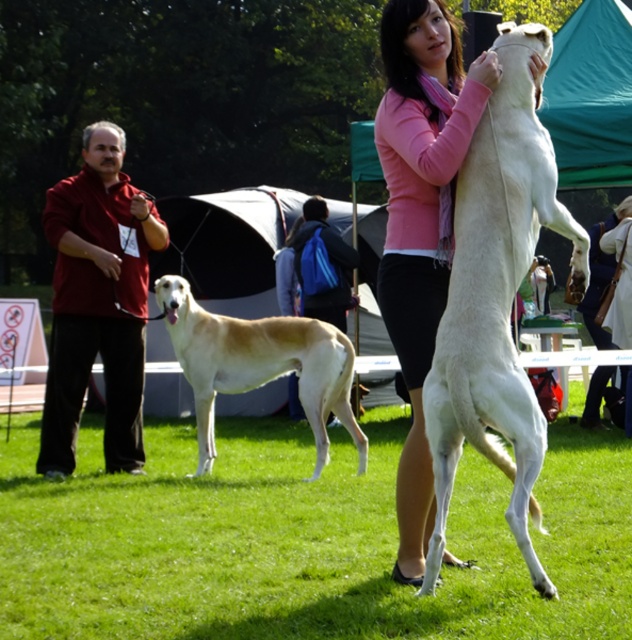
Where is `white smooth dog at center`? The image size is (632, 640). white smooth dog at center is located at coordinates (495, 300).

Measure the distance between white smooth dog at center and pink fabric scarf at upper center.

14.53 inches

Locate an element on the screen. This screenshot has width=632, height=640. white smooth dog at center is located at coordinates (495, 300).

Who is higher up, pink fabric scarf at upper center or light beige fur at center?

pink fabric scarf at upper center is above.

Between point (384, 134) and point (355, 436), which one is positioned in front?

Point (384, 134)

Find the location of a particular element. pink fabric scarf at upper center is located at coordinates (420, 220).

Which is behind, point (495, 365) or point (360, 448)?

The point (360, 448) is behind.

Image resolution: width=632 pixels, height=640 pixels. What do you see at coordinates (495, 300) in the screenshot? I see `white smooth dog at center` at bounding box center [495, 300].

Describe the element at coordinates (495, 300) in the screenshot. I see `white smooth dog at center` at that location.

Locate an element on the screen. The height and width of the screenshot is (640, 632). white smooth dog at center is located at coordinates (495, 300).